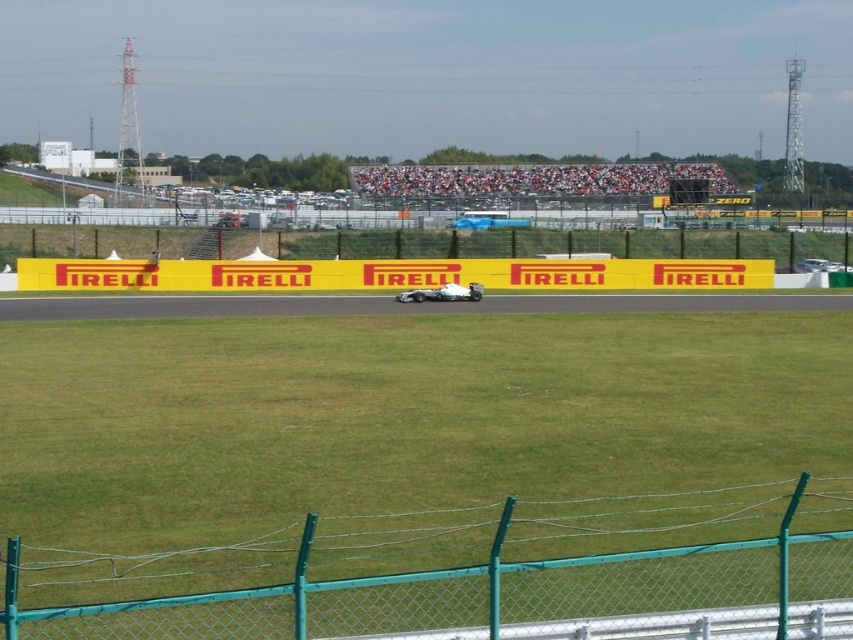
Which is more to the left, green chain-link fence at lower center or white matte race car at center?

From the viewer's perspective, white matte race car at center appears more on the left side.

Does green chain-link fence at lower center come behind white matte race car at center?

No, it is not.

Image resolution: width=853 pixels, height=640 pixels. Find the location of `green chain-link fence at lower center`. green chain-link fence at lower center is located at coordinates (497, 595).

Where is `green chain-link fence at lower center`? This screenshot has height=640, width=853. green chain-link fence at lower center is located at coordinates (497, 595).

Between point (199, 282) and point (421, 289), which one is positioned behind?

Positioned behind is point (199, 282).

Between point (670, 280) and point (426, 296), which one is positioned in front?

Point (426, 296) is more forward.

This screenshot has height=640, width=853. Describe the element at coordinates (389, 275) in the screenshot. I see `yellow/yellowish plastic banner at center` at that location.

In order to click on yellow/yellowish plastic banner at center in this screenshot , I will do `click(389, 275)`.

Between green chain-link fence at lower center and yellow/yellowish plastic banner at center, which one appears on the left side from the viewer's perspective?

yellow/yellowish plastic banner at center is more to the left.

Does green chain-link fence at lower center appear under yellow/yellowish plastic banner at center?

Indeed, green chain-link fence at lower center is positioned under yellow/yellowish plastic banner at center.

Who is more distant from viewer, (525, 572) or (688, 282)?

The point (688, 282) is more distant.

Identify the location of green chain-link fence at lower center. (497, 595).